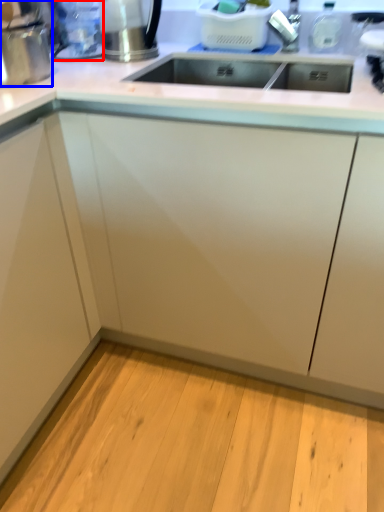
Question: Which object appears closest to the camera in this image, appliance (highlighted by a red box) or appliance (highlighted by a blue box)?

Choices:
 (A) appliance
 (B) appliance

Answer: (B)